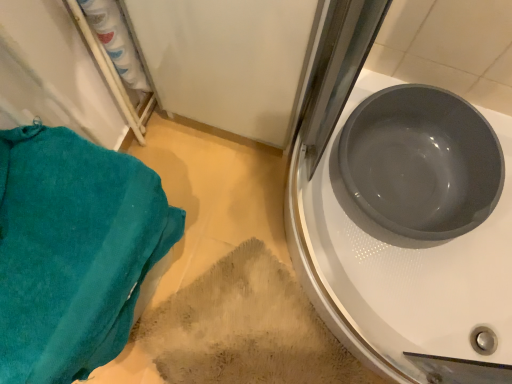
Question: From a real-world perspective, is beige textured rug at lower center on matte gray basin at upper right?

Choices:
 (A) no
 (B) yes

Answer: (A)

Question: From the image's perspective, is beige textured rug at lower center beneath matte gray basin at upper right?

Choices:
 (A) yes
 (B) no

Answer: (A)

Question: Are beige textured rug at lower center and matte gray basin at upper right far apart?

Choices:
 (A) no
 (B) yes

Answer: (A)

Question: Is the depth of beige textured rug at lower center greater than that of matte gray basin at upper right?

Choices:
 (A) no
 (B) yes

Answer: (B)

Question: Does beige textured rug at lower center have a smaller size compared to matte gray basin at upper right?

Choices:
 (A) yes
 (B) no

Answer: (A)

Question: Is point (509, 266) positioned closer to the camera than point (430, 190)?

Choices:
 (A) closer
 (B) farther

Answer: (A)

Question: Which is correct: matte gray basin at upper right is inside matte gray basin at right, or outside of it?

Choices:
 (A) inside
 (B) outside

Answer: (B)

Question: From their relative heights in the image, would you say matte gray basin at upper right is taller or shorter than matte gray basin at right?

Choices:
 (A) short
 (B) tall

Answer: (B)

Question: Considering their positions, is matte gray basin at upper right located in front of or behind matte gray basin at right?

Choices:
 (A) behind
 (B) front

Answer: (B)

Question: Considering the positions of point (413, 117) and point (266, 253), is point (413, 117) closer or farther from the camera than point (266, 253)?

Choices:
 (A) closer
 (B) farther

Answer: (A)

Question: In terms of width, does matte gray basin at right look wider or thinner when compared to beige textured rug at lower center?

Choices:
 (A) wide
 (B) thin

Answer: (B)

Question: Would you say matte gray basin at right is to the left or to the right of beige textured rug at lower center in the picture?

Choices:
 (A) left
 (B) right

Answer: (B)

Question: Would you say matte gray basin at right is inside or outside beige textured rug at lower center?

Choices:
 (A) inside
 (B) outside

Answer: (B)

Question: Considering the positions of point (41, 183) and point (439, 190), is point (41, 183) closer or farther from the camera than point (439, 190)?

Choices:
 (A) farther
 (B) closer

Answer: (B)

Question: In terms of height, does teal terry cloth towel at lower left look taller or shorter compared to matte gray basin at right?

Choices:
 (A) tall
 (B) short

Answer: (A)